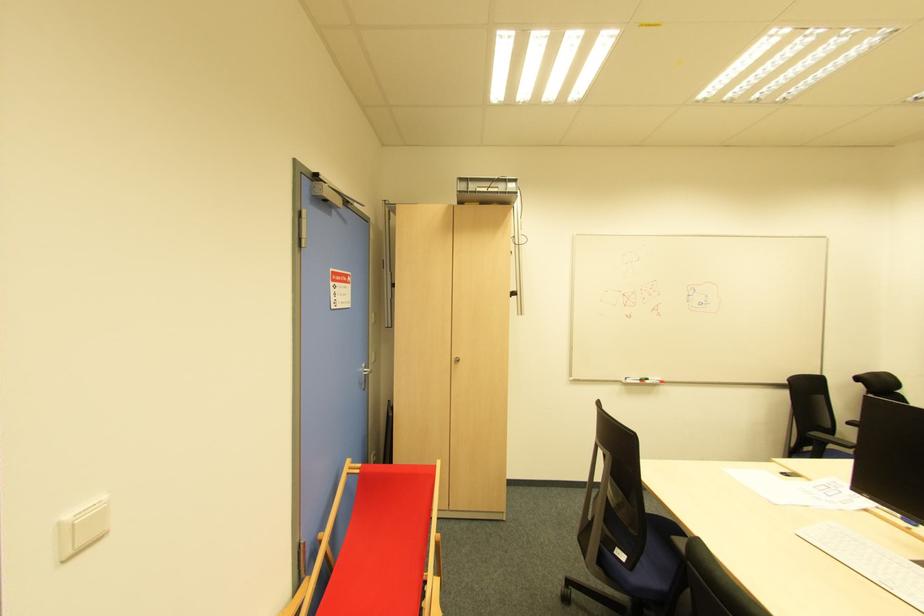
Find where to sit the red chair sitting surface. Please return your answer as a coordinate pair (x, y).

(383, 544)